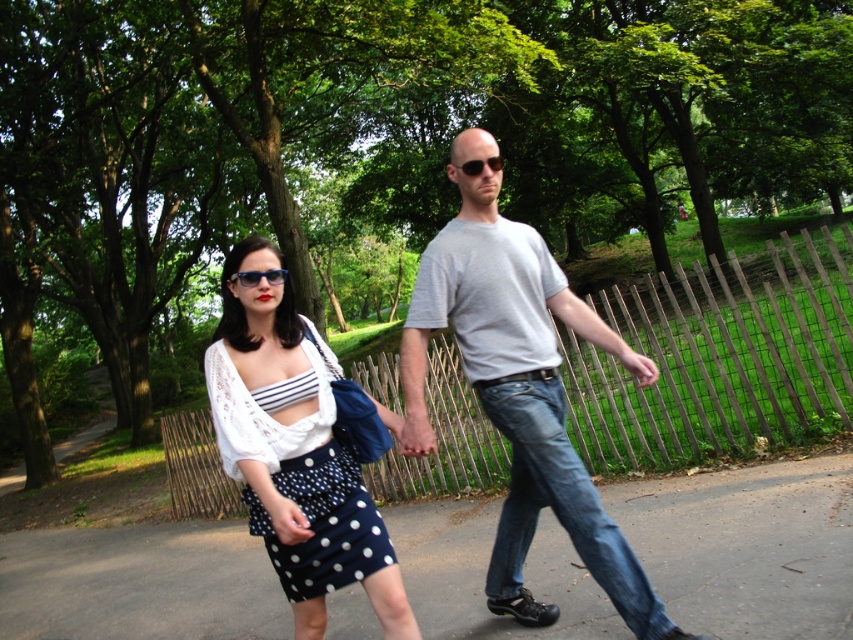
Can you confirm if gray asphalt pavement at center is smaller than navy polka dot skirt at center?

Actually, gray asphalt pavement at center might be larger than navy polka dot skirt at center.

Between gray asphalt pavement at center and navy polka dot skirt at center, which one has less height?

Standing shorter between the two is navy polka dot skirt at center.

Image resolution: width=853 pixels, height=640 pixels. In order to click on gray asphalt pavement at center in this screenshot , I will do `click(747, 547)`.

Find the location of a particular element. gray asphalt pavement at center is located at coordinates (747, 547).

How distant is gray cotton t-shirt at center from shiny black sunglasses at center?

The distance of gray cotton t-shirt at center from shiny black sunglasses at center is 1.23 meters.

Is gray cotton t-shirt at center smaller than shiny black sunglasses at center?

Incorrect, gray cotton t-shirt at center is not smaller in size than shiny black sunglasses at center.

Between point (509, 424) and point (239, 272), which one is positioned in front?

Point (239, 272)

Where is `gray cotton t-shirt at center`? gray cotton t-shirt at center is located at coordinates (520, 388).

Consider the image. Which is more to the right, navy polka dot skirt at center or shiny black sunglasses at center?

Positioned to the right is navy polka dot skirt at center.

Which is in front, point (289, 388) or point (270, 278)?

Point (289, 388) is more forward.

The image size is (853, 640). What are the coordinates of `navy polka dot skirt at center` in the screenshot? It's located at (300, 474).